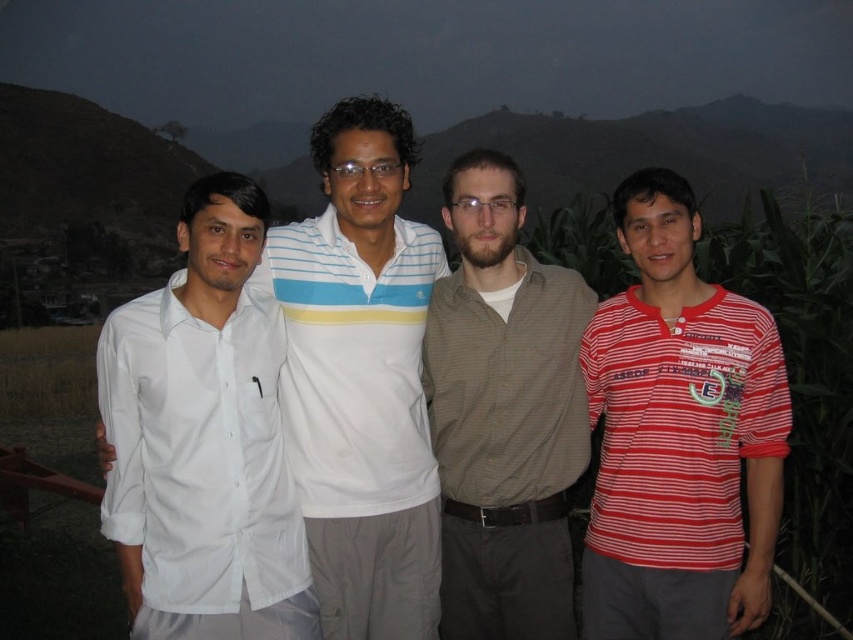
Is red striped shirt at right wider than white cotton shirt at left?

No.

Describe the element at coordinates (679, 435) in the screenshot. Image resolution: width=853 pixels, height=640 pixels. I see `red striped shirt at right` at that location.

Locate an element on the screen. The image size is (853, 640). red striped shirt at right is located at coordinates (679, 435).

Between white cotton shirt at center and brown textured shirt at center, which one appears on the right side from the viewer's perspective?

From the viewer's perspective, brown textured shirt at center appears more on the right side.

Does white cotton shirt at center appear under brown textured shirt at center?

Actually, white cotton shirt at center is above brown textured shirt at center.

Who is more distant from viewer, (x=381, y=326) or (x=490, y=502)?

Positioned behind is point (x=381, y=326).

At what (x,y) coordinates should I click in order to perform the action: click on white cotton shirt at center. Please return your answer as a coordinate pair (x, y). Looking at the image, I should click on (363, 378).

Can you confirm if white cotton shirt at center is positioned below white cotton shirt at left?

Incorrect, white cotton shirt at center is not positioned below white cotton shirt at left.

Does white cotton shirt at center appear on the left side of white cotton shirt at left?

Incorrect, white cotton shirt at center is not on the left side of white cotton shirt at left.

Who is more distant from viewer, [405,364] or [260,534]?

Point [405,364]

Find the location of a particular element. The height and width of the screenshot is (640, 853). white cotton shirt at center is located at coordinates (363, 378).